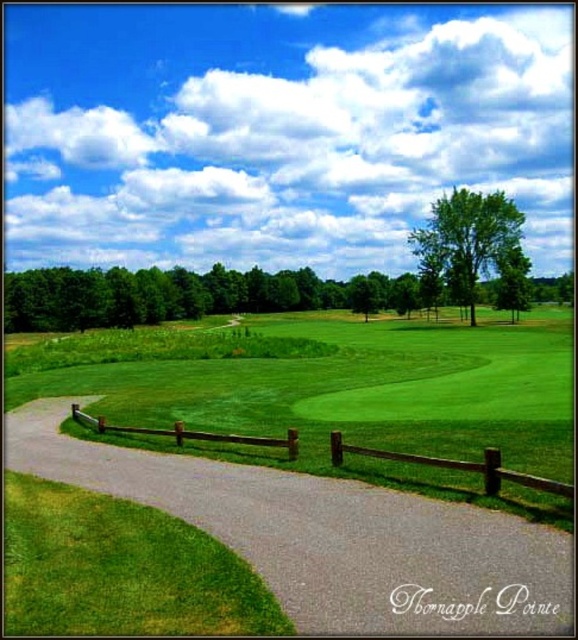
You are standing at the viewpoint of the image and want to reach the point marked as point (x=451, y=248). If your walking speed is 1.5 meters per second, how many seconds will it take you to reach there?

The distance between you and point (x=451, y=248) is 556.13 meters. At a speed of 1.5 meters per second, it will take approximately 556.13 divided by 1.5, which equals about 370.75 seconds to reach the point.

You are a golfer standing on the gray asphalt path at center and want to hit a ball towards the green leafy tree at center. Which direction should you aim to reach the tree?

The gray asphalt path at center is positioned on the left side of green leafy tree at center, so you should aim to the right to reach the tree.

In the scene shown: You are standing on the golf course and want to walk from the point at coordinates point [501,246] to the point at coordinates point [246,440]. Which direction should you move to get closer to your destination?

You should move away from the viewer because point [501,246] is further to the viewer than point [246,440]. Moving away from the viewer would take you towards the destination.